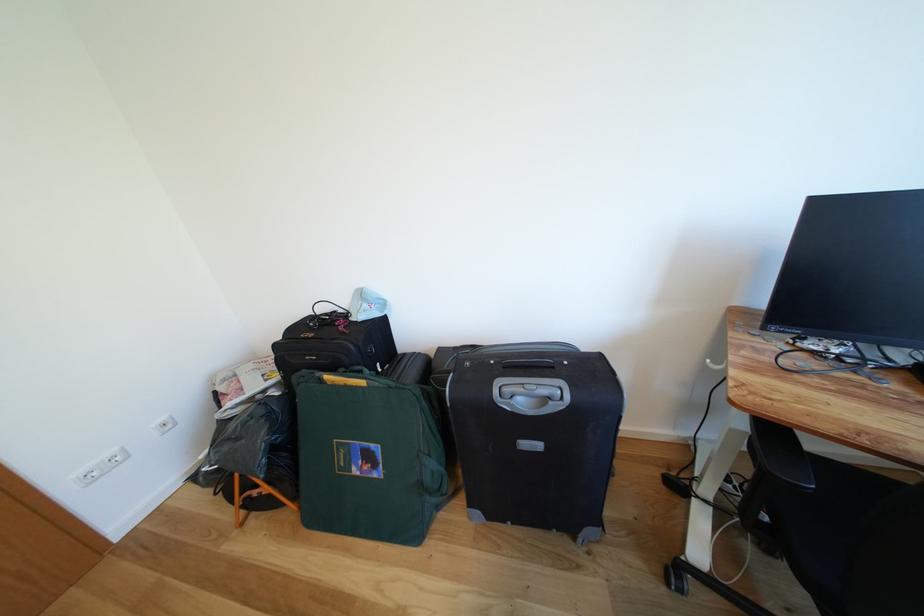
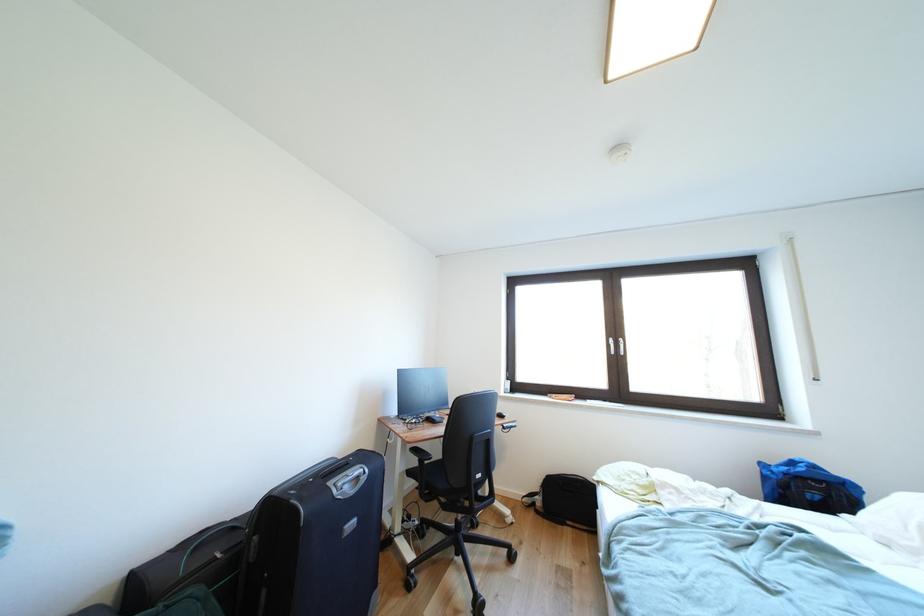
First-person continuous shooting, in which direction is the camera rotating?

The rotation direction of the camera is right-up.